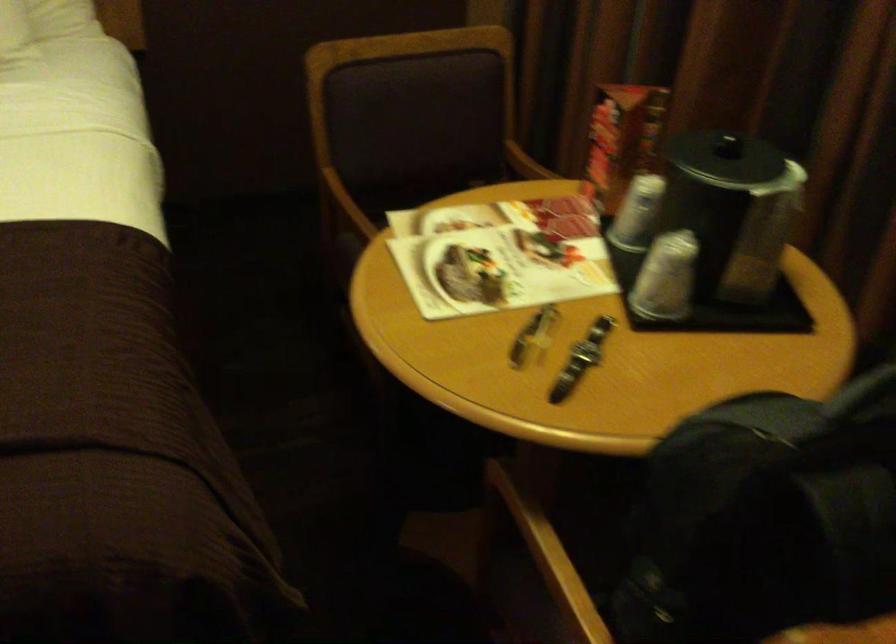
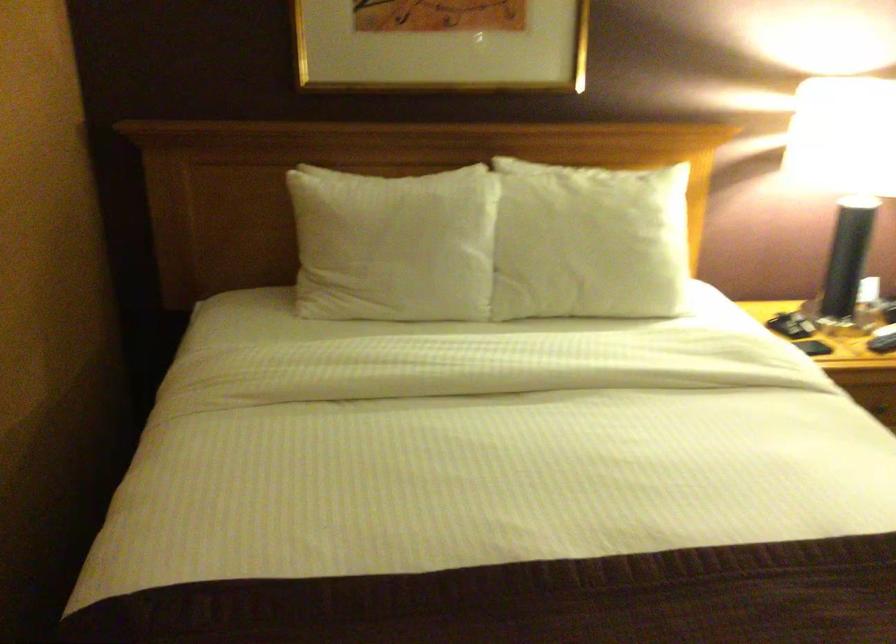
Question: The images are taken continuously from a first-person perspective. In which direction are you moving?

Choices:
 (A) Left
 (B) Right
 (C) Forward
 (D) Backward

Answer: (A)